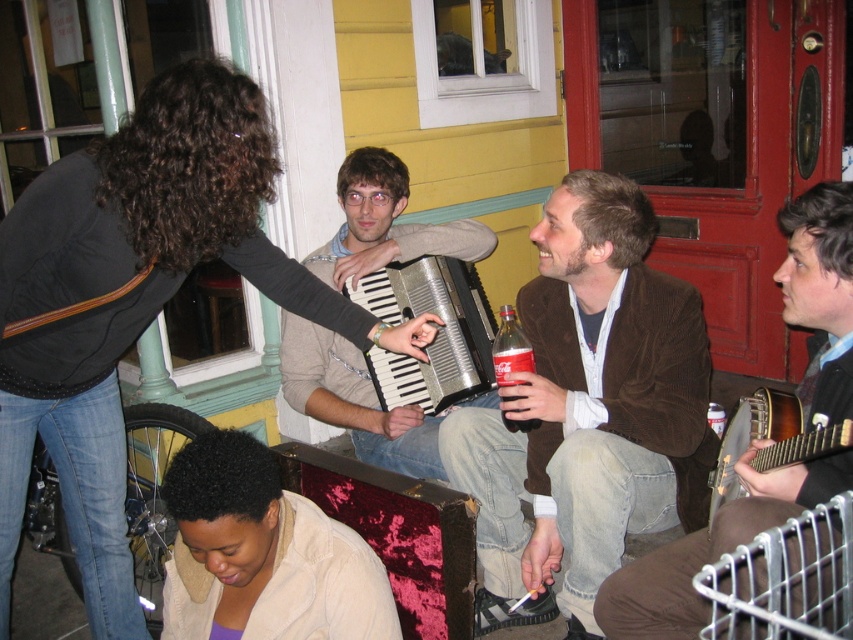
Question: Which of these objects is positioned closest to the wooden banjo at right?

Choices:
 (A) metallic accordion at center
 (B) metallic silver accordion at center

Answer: (B)

Question: Does dark brown hair at upper left appear over wooden banjo at right?

Choices:
 (A) yes
 (B) no

Answer: (A)

Question: Can you confirm if beige fleece jacket at lower center is smaller than metallic accordion at center?

Choices:
 (A) no
 (B) yes

Answer: (B)

Question: From the image, what is the correct spatial relationship of dark brown hair at upper left in relation to wooden banjo at center right?

Choices:
 (A) left
 (B) right

Answer: (A)

Question: Which object is positioned closest to the metallic accordion at center?

Choices:
 (A) beige fleece jacket at lower center
 (B) wooden banjo at right
 (C) dark brown hair at upper left

Answer: (C)

Question: Among these points, which one is farthest from the camera?

Choices:
 (A) (560, 323)
 (B) (751, 403)
 (C) (786, 467)

Answer: (A)